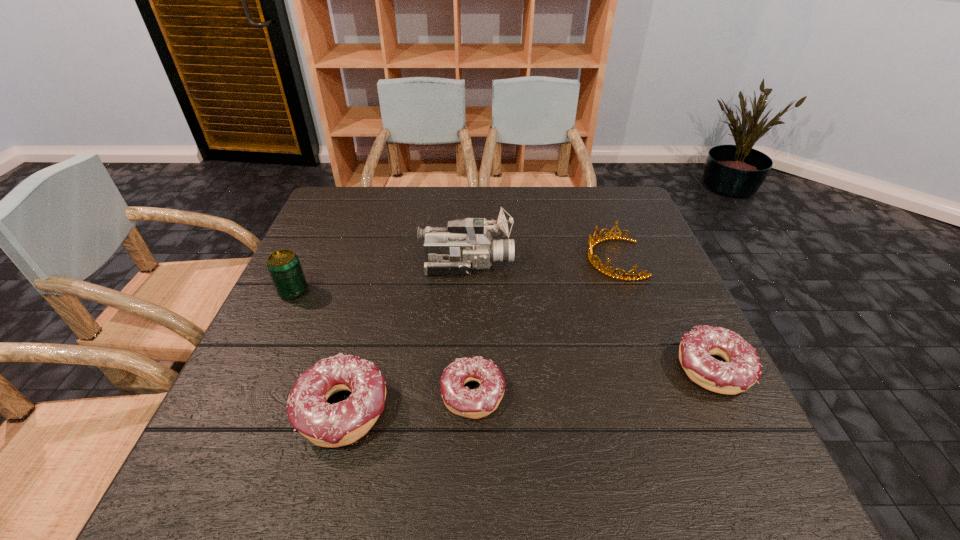
The height and width of the screenshot is (540, 960). Find the location of `empty space that is in between the shortest doughnut and the second object from left to right`. empty space that is in between the shortest doughnut and the second object from left to right is located at coordinates (408, 402).

Locate an element on the screen. The height and width of the screenshot is (540, 960). empty space that is in between the tiara and the leftmost doughnut is located at coordinates click(478, 334).

Locate an element on the screen. This screenshot has width=960, height=540. free point between the second shortest object and the tiara is located at coordinates (663, 314).

The width and height of the screenshot is (960, 540). I want to click on vacant area between the shortest object and the rightmost doughnut, so click(592, 381).

I want to click on vacant region between the leftmost object and the tiara, so click(454, 275).

At what (x,y) coordinates should I click in order to perform the action: click on unoccupied position between the tiara and the tallest object. Please return your answer as a coordinate pair (x, y). Looking at the image, I should click on (540, 261).

The width and height of the screenshot is (960, 540). In order to click on empty space between the second doughnut from left to right and the beer can in this screenshot , I will do `click(383, 343)`.

Locate an element on the screen. free space between the beer can and the second tallest doughnut is located at coordinates (503, 330).

Identify the location of unoccupied position between the fifth tallest object and the second object from left to right. (527, 389).

Locate an element on the screen. The image size is (960, 540). vacant space that's between the second shortest doughnut and the camcorder is located at coordinates (589, 316).